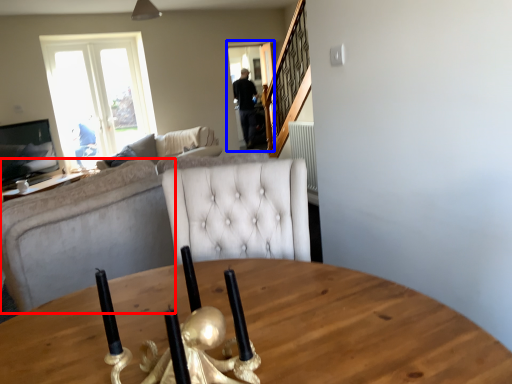
Question: Which object appears farthest to the camera in this image, studio couch (highlighted by a red box) or glass door (highlighted by a blue box)?

Choices:
 (A) studio couch
 (B) glass door

Answer: (B)